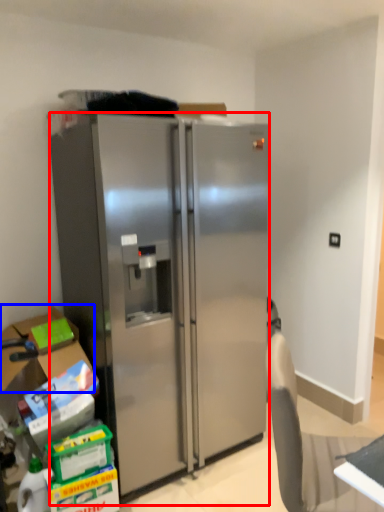
Question: Which of the following is the closest to the observer, refrigerator (highlighted by a red box) or box (highlighted by a blue box)?

Choices:
 (A) refrigerator
 (B) box

Answer: (A)